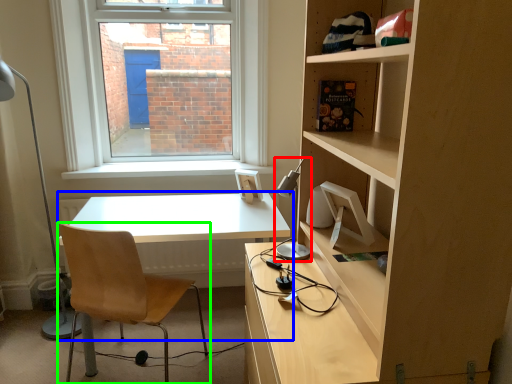
Question: Which object is the closest to the table lamp (highlighted by a red box)? Choose among these: table (highlighted by a blue box) or chair (highlighted by a green box).

Choices:
 (A) table
 (B) chair

Answer: (A)